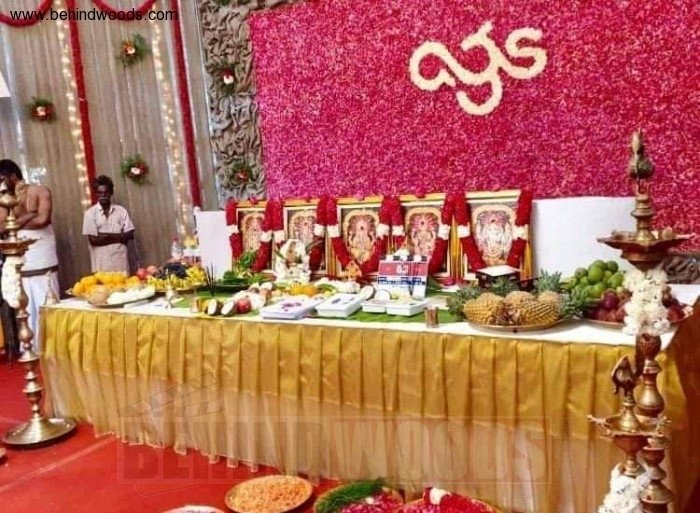
Locate an element on the screen. curtain is located at coordinates 55,64, 115,96.